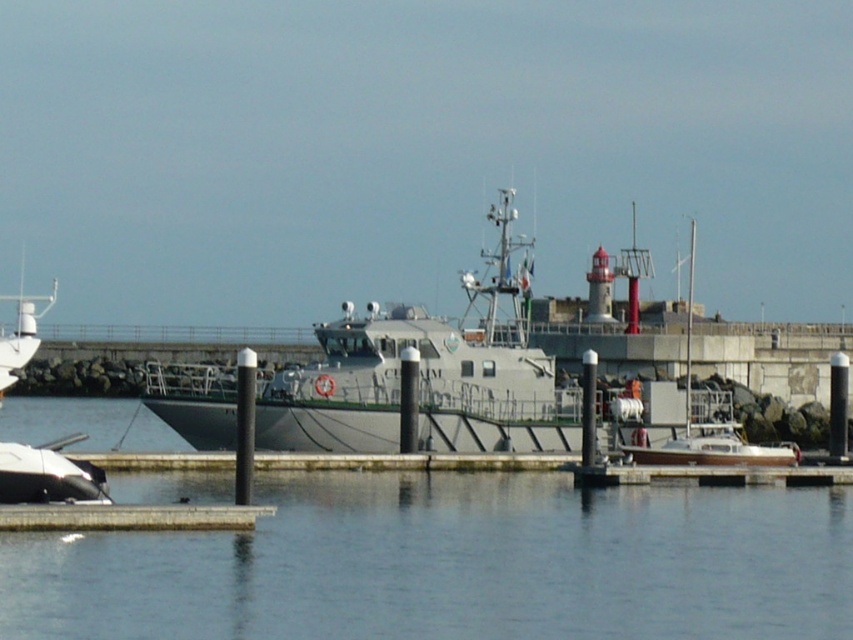
Can you confirm if gray matte boat at center is positioned above white matte boat at lower left?

Indeed, gray matte boat at center is positioned over white matte boat at lower left.

Which is in front, point (325, 371) or point (68, 464)?

Point (68, 464)

Identify the location of gray matte boat at center. The image size is (853, 640). (422, 372).

Can you confirm if transparent water at center is positioned below gray matte boat at center?

Correct, transparent water at center is located below gray matte boat at center.

Which is above, transparent water at center or gray matte boat at center?

gray matte boat at center is higher up.

Locate an element on the screen. This screenshot has width=853, height=640. transparent water at center is located at coordinates (454, 564).

Does transparent water at center appear under white matte boat at lower left?

Yes, transparent water at center is below white matte boat at lower left.

Is point (488, 577) positioned before point (1, 490)?

Yes, it is.

Is point (643, 620) positioned in front of point (54, 497)?

Yes, point (643, 620) is in front of point (54, 497).

Where is `transparent water at center`? Image resolution: width=853 pixels, height=640 pixels. transparent water at center is located at coordinates (454, 564).